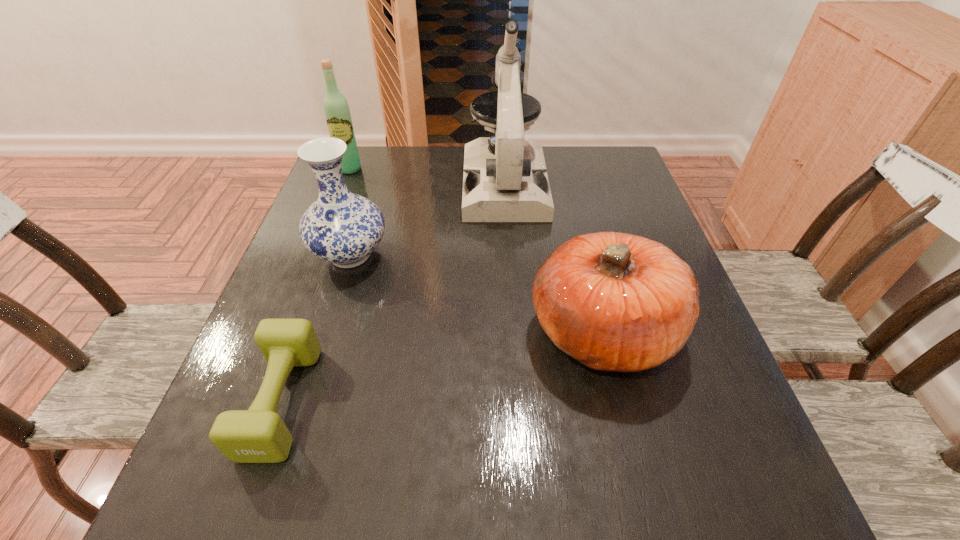
Where is `the tallest object`? The width and height of the screenshot is (960, 540). the tallest object is located at coordinates (505, 179).

Image resolution: width=960 pixels, height=540 pixels. Find the location of `wine bottle`. wine bottle is located at coordinates (336, 109).

You are a GUI agent. You are given a task and a screenshot of the screen. Output one action in this format:
    pyautogui.click(x=<x>, y=<y>)
    Task: Click on the vase
    This screenshot has width=960, height=540.
    Given the screenshot: What is the action you would take?
    pyautogui.click(x=340, y=227)

The height and width of the screenshot is (540, 960). Identify the location of pumpkin. (613, 301).

Where is `the shortest object`? the shortest object is located at coordinates (258, 435).

Locate an element on the screen. The width and height of the screenshot is (960, 540). free location located at the eyepiece of the microscope is located at coordinates (511, 264).

This screenshot has height=540, width=960. Find the location of `free space located 0.120m on the front-facing side of the wine bottle`. free space located 0.120m on the front-facing side of the wine bottle is located at coordinates (338, 200).

Identify the location of free region located 0.270m on the back of the vase. (376, 171).

This screenshot has height=540, width=960. Identify the location of vacant region located 0.380m on the left of the second shortest object. (332, 332).

Find the location of a particular element. The image size is (960, 540). free space located 0.240m on the right of the shortest object is located at coordinates (450, 401).